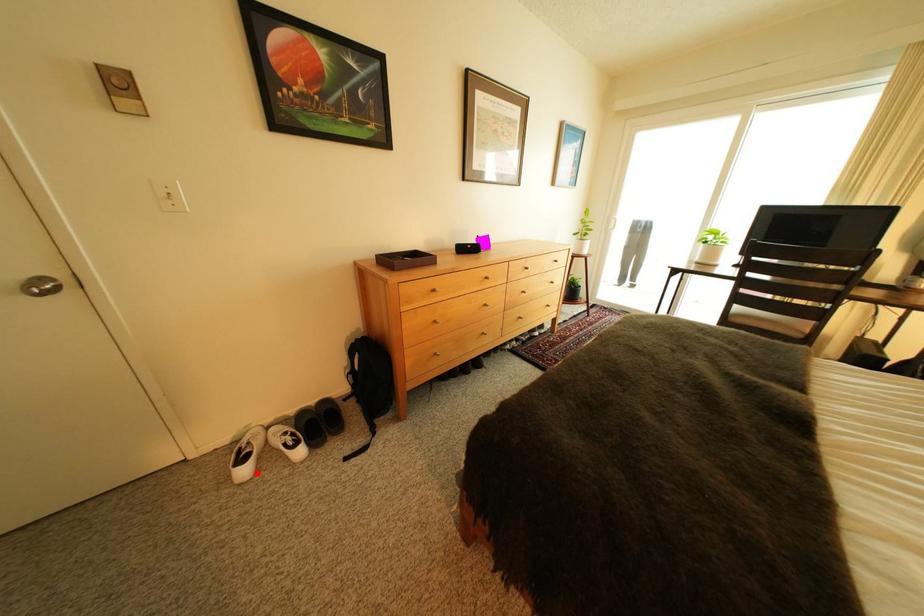
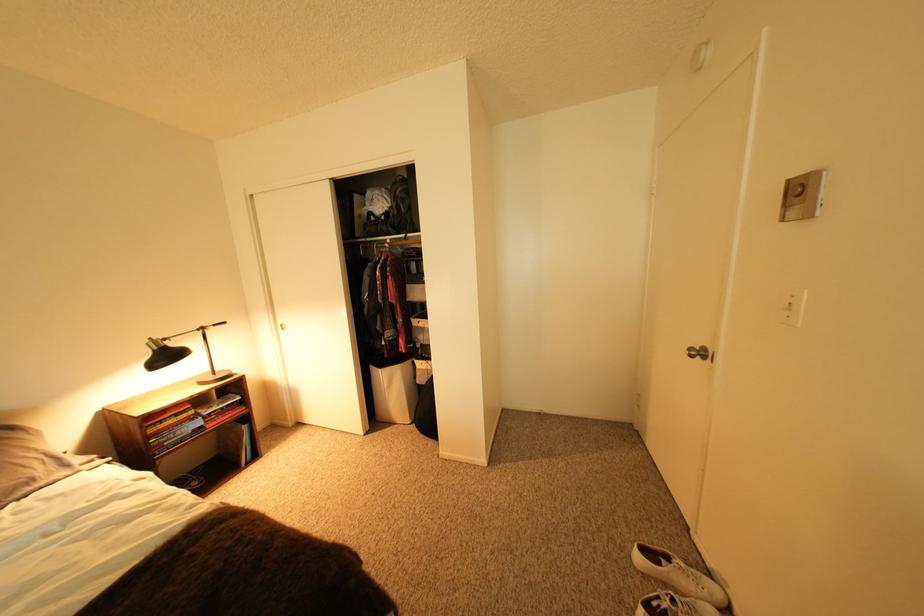
Where in the second image is the point corresponding to the highlighted location from the first image?

(651, 560)